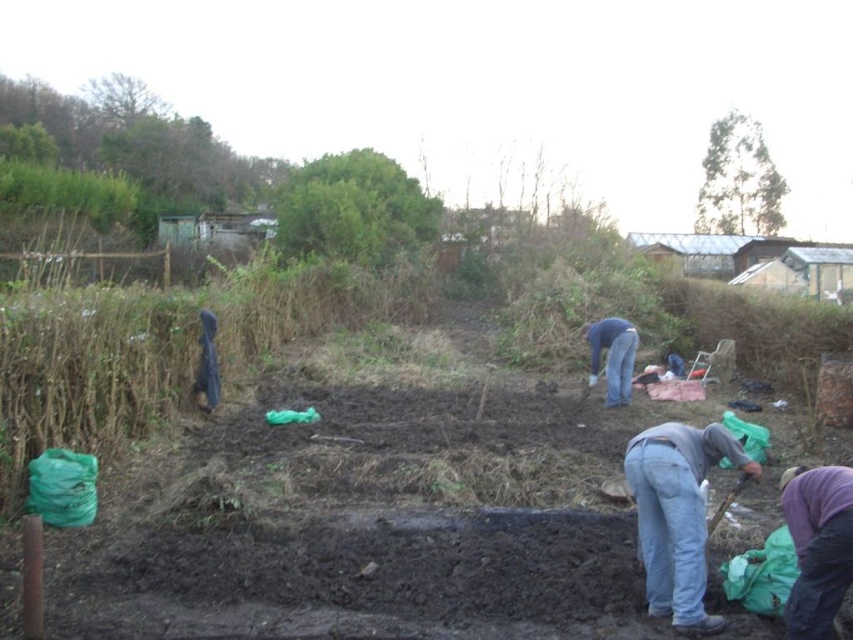
Does gray cotton shirt at lower right have a larger size compared to wooden handle shovel at lower right?

Yes.

Can you confirm if gray cotton shirt at lower right is wider than wooden handle shovel at lower right?

Indeed, gray cotton shirt at lower right has a greater width compared to wooden handle shovel at lower right.

Locate an element on the screen. gray cotton shirt at lower right is located at coordinates (677, 515).

Can you confirm if purple fabric at lower right is bigger than wooden handle shovel at lower right?

Yes.

Can you confirm if purple fabric at lower right is positioned to the right of wooden handle shovel at lower right?

Indeed, purple fabric at lower right is positioned on the right side of wooden handle shovel at lower right.

Where is `purple fabric at lower right`? This screenshot has height=640, width=853. purple fabric at lower right is located at coordinates (817, 547).

Locate an element on the screen. The height and width of the screenshot is (640, 853). purple fabric at lower right is located at coordinates (817, 547).

What do you see at coordinates (612, 356) in the screenshot? The image size is (853, 640). I see `blue jeans at center` at bounding box center [612, 356].

Does blue jeans at center appear under wooden handle shovel at lower right?

No.

Who is more forward, (607, 344) or (726, 508)?

Point (726, 508)

Where is `blue jeans at center`? The width and height of the screenshot is (853, 640). blue jeans at center is located at coordinates (612, 356).